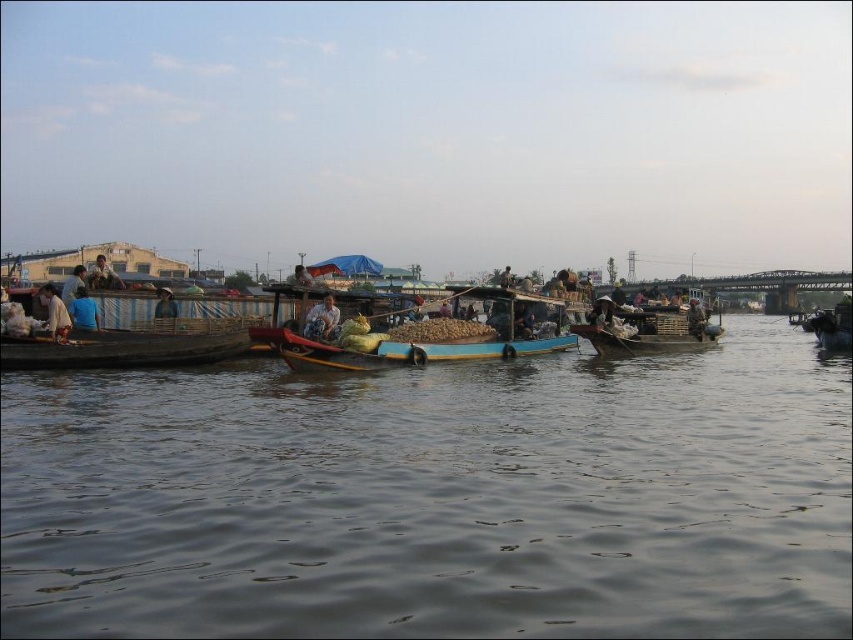
Question: Which object is closer to the camera taking this photo?

Choices:
 (A) blue fabric person at left
 (B) brown woven basket at center

Answer: (A)

Question: Is brown wooden boats at center below blue fabric person at left?

Choices:
 (A) yes
 (B) no

Answer: (A)

Question: Among these objects, which one is farthest from the camera?

Choices:
 (A) wooden boat at center
 (B) wooden crate boat at center
 (C) brown woven basket at center
 (D) wooden boat at left

Answer: (C)

Question: From the image, what is the correct spatial relationship of blue fabric person at left in relation to light brown wooden boat at center?

Choices:
 (A) above
 (B) below

Answer: (B)

Question: Which object is farther from the camera taking this photo?

Choices:
 (A) light brown fabric shirt at left
 (B) light brown wooden boat at center
 (C) wooden boat at left

Answer: (A)

Question: In this image, where is wooden boat at left located relative to brown woven basket at center?

Choices:
 (A) right
 (B) left

Answer: (B)